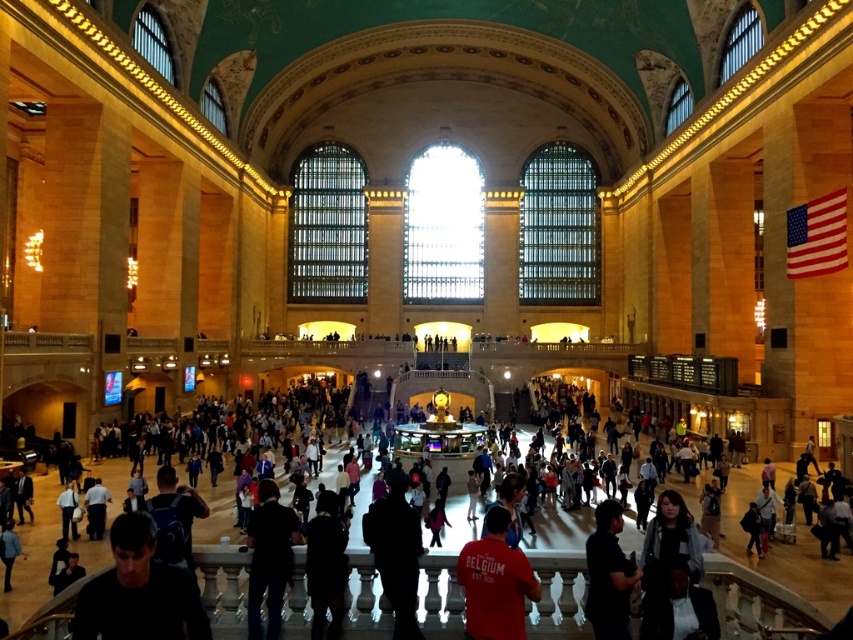
Is dark gray shirt at lower left to the right of silhouette clothing at center from the viewer's perspective?

Incorrect, dark gray shirt at lower left is not on the right side of silhouette clothing at center.

Can you confirm if dark gray shirt at lower left is shorter than silhouette clothing at center?

Correct, dark gray shirt at lower left is not as tall as silhouette clothing at center.

Who is more forward, (148, 550) or (393, 593)?

Point (148, 550)

You are a GUI agent. You are given a task and a screenshot of the screen. Output one action in this format:
    pyautogui.click(x=<x>, y=<y>)
    Task: Click on the dark gray shirt at lower left
    The image size is (853, 640).
    Given the screenshot: What is the action you would take?
    tap(138, 592)

Which of these two, red t-shirt at center or dark blue shirt at lower right, stands shorter?

red t-shirt at center is shorter.

Does red t-shirt at center appear on the left side of dark blue shirt at lower right?

Indeed, red t-shirt at center is positioned on the left side of dark blue shirt at lower right.

At what (x,y) coordinates should I click in order to perform the action: click on red t-shirt at center. Please return your answer as a coordinate pair (x, y). The width and height of the screenshot is (853, 640). Looking at the image, I should click on click(x=495, y=582).

Where is `red t-shirt at center`? This screenshot has width=853, height=640. red t-shirt at center is located at coordinates (495, 582).

Where is `dark blue shirt at center`? The width and height of the screenshot is (853, 640). dark blue shirt at center is located at coordinates (221, 570).

Can you confirm if dark blue shirt at center is taller than silhouette clothing at center?

Correct, dark blue shirt at center is much taller as silhouette clothing at center.

What do you see at coordinates (221, 570) in the screenshot? I see `dark blue shirt at center` at bounding box center [221, 570].

You are a GUI agent. You are given a task and a screenshot of the screen. Output one action in this format:
    pyautogui.click(x=<x>, y=<y>)
    Task: Click on the dark blue shirt at center
    
    Given the screenshot: What is the action you would take?
    pyautogui.click(x=221, y=570)